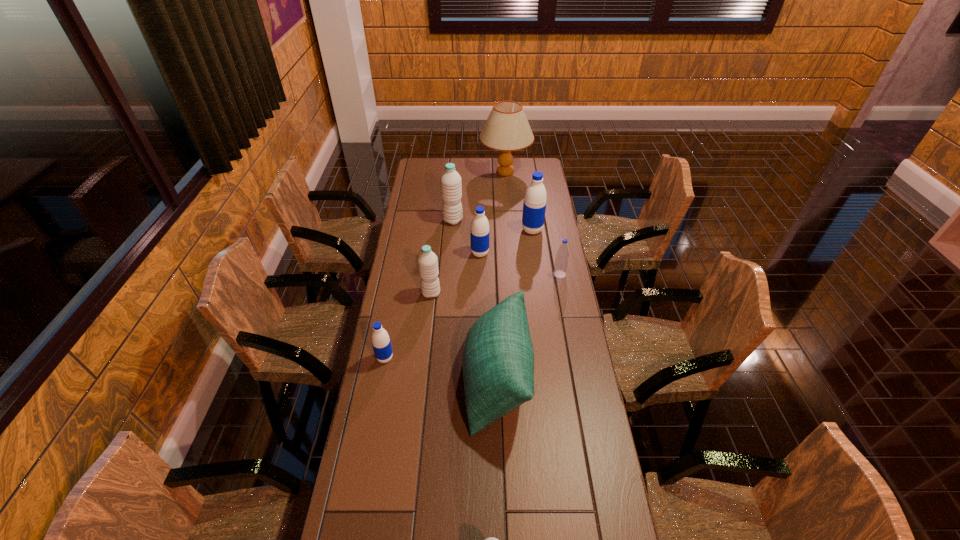
Select which water bottle is the third closest to the second nearest water bottle. Please provide its 2D coordinates. Your answer should be formatted as a tuple, i.e. [(x, y)], where the tuple contains the x and y coordinates of a point satisfying the conditions above.

[(491, 539)]

Locate an element on the screen. This screenshot has height=540, width=960. the second closest white water bottle to the beige lampshade is located at coordinates (427, 260).

Image resolution: width=960 pixels, height=540 pixels. Find the location of `the second closest white water bottle to the third farthest blue water bottle`. the second closest white water bottle to the third farthest blue water bottle is located at coordinates (451, 185).

This screenshot has height=540, width=960. In order to click on blue water bottle object that ranks as the third closest to the cushion in this screenshot , I will do `click(479, 234)`.

Locate an element on the screen. The image size is (960, 540). blue water bottle that is the third closest to the cushion is located at coordinates (479, 234).

You are a GUI agent. You are given a task and a screenshot of the screen. Output one action in this format:
    pyautogui.click(x=<x>, y=<y>)
    Task: Click on the vacant space that satisfies the following two spatial constraints: 1. on the back side of the rightmost object; 2. on the right side of the nearest blue water bottle
    Image resolution: width=960 pixels, height=540 pixels.
    Given the screenshot: What is the action you would take?
    (400, 274)

At what (x,y) coordinates should I click in order to perform the action: click on blank space that satisfies the following two spatial constraints: 1. on the back side of the fifth nearest water bottle; 2. on the left side of the nearest blue water bottle. Please return your answer as a coordinate pair (x, y). Looking at the image, I should click on (404, 253).

You are a GUI agent. You are given a task and a screenshot of the screen. Output one action in this format:
    pyautogui.click(x=<x>, y=<y>)
    Task: Click on the blank area in the image that satisfies the following two spatial constraints: 1. on the back side of the second nearest white water bottle; 2. on the right side of the rightmost water bottle
    This screenshot has height=540, width=960.
    Given the screenshot: What is the action you would take?
    pyautogui.click(x=433, y=274)

Locate an element on the screen. Image resolution: width=960 pixels, height=540 pixels. vacant area in the image that satisfies the following two spatial constraints: 1. on the front side of the farthest white water bottle; 2. on the left side of the farthest blue water bottle is located at coordinates (452, 230).